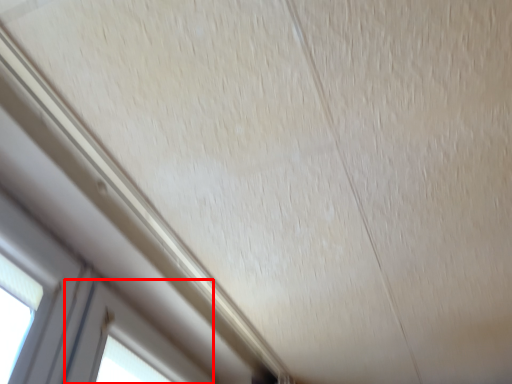
Question: Observing the image, what is the correct spatial positioning of window (annotated by the red box) in reference to window?

Choices:
 (A) left
 (B) right

Answer: (B)